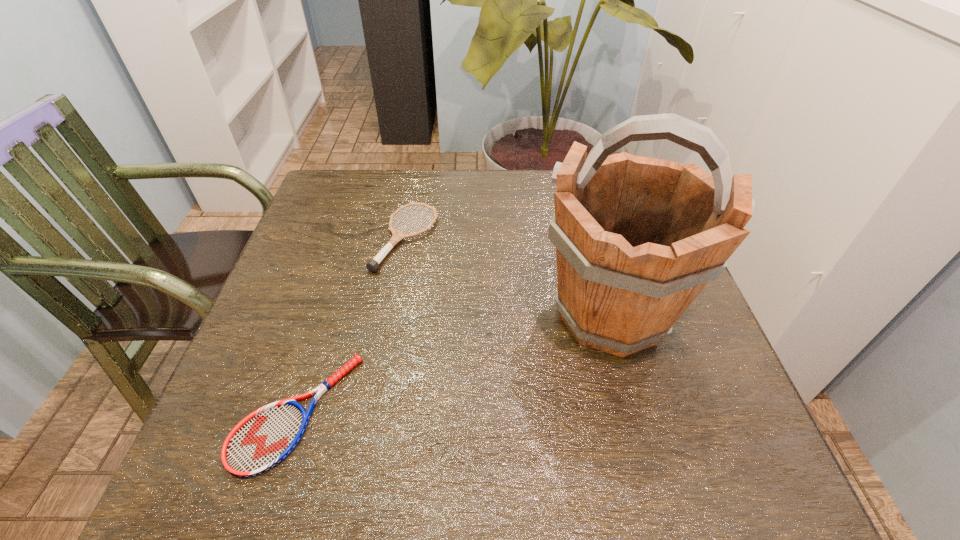
The width and height of the screenshot is (960, 540). I want to click on object at the near edge, so click(263, 439).

Find the location of a particular element. The width and height of the screenshot is (960, 540). object at the left edge is located at coordinates (263, 439).

Identify the location of object that is at the right edge. The image size is (960, 540). (637, 239).

Locate an element on the screen. Image resolution: width=960 pixels, height=540 pixels. object that is at the near left corner is located at coordinates (263, 439).

The image size is (960, 540). I want to click on vacant area at the far edge of the desktop, so click(x=509, y=204).

In the image, there is a desktop. Where is `vacant space at the left edge`? This screenshot has height=540, width=960. vacant space at the left edge is located at coordinates (328, 340).

Locate an element on the screen. Image resolution: width=960 pixels, height=540 pixels. free space at the right edge of the desktop is located at coordinates (665, 349).

This screenshot has height=540, width=960. What are the coordinates of `vacant point located between the taller tennis racket and the bucket` in the screenshot? It's located at (508, 276).

Where is `unoccupied area between the taller tennis racket and the bucket`? The image size is (960, 540). unoccupied area between the taller tennis racket and the bucket is located at coordinates (508, 276).

Identify the location of free space between the rightmost object and the farther tennis racket. (508, 276).